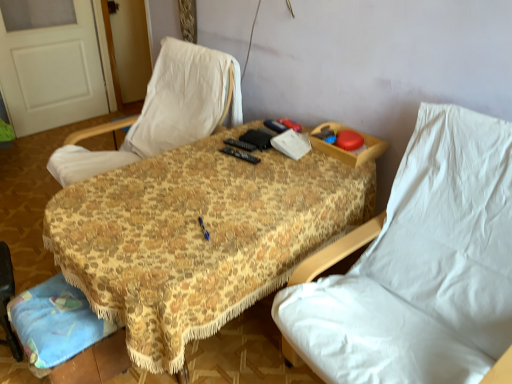
Question: Does white matte door at upper left have a lesser width compared to white fabric chair at right, positioned as the first chair in right-to-left order?

Choices:
 (A) yes
 (B) no

Answer: (A)

Question: Is white fabric chair at right, positioned as the first chair in right-to-left order, completely or partially inside white matte door at upper left?

Choices:
 (A) yes
 (B) no

Answer: (B)

Question: Is the depth of white matte door at upper left greater than that of white fabric chair at right, positioned as the first chair in right-to-left order?

Choices:
 (A) no
 (B) yes

Answer: (B)

Question: Is white matte door at upper left smaller than white fabric chair at right, positioned as the first chair in right-to-left order?

Choices:
 (A) no
 (B) yes

Answer: (B)

Question: Is white matte door at upper left beside white fabric chair at right, the second chair viewed from the left?

Choices:
 (A) no
 (B) yes

Answer: (A)

Question: Is white matte door at upper left taller than white fabric chair at right, positioned as the first chair in right-to-left order?

Choices:
 (A) yes
 (B) no

Answer: (A)

Question: From the image's perspective, would you say white fabric chair at center, which ranks as the 1th chair in left-to-right order, is shown under floral fabric table at center?

Choices:
 (A) yes
 (B) no

Answer: (B)

Question: Does white fabric chair at center, which ranks as the 1th chair in left-to-right order, come in front of floral fabric table at center?

Choices:
 (A) no
 (B) yes

Answer: (A)

Question: Considering the relative sizes of white fabric chair at center, which ranks as the 1th chair in left-to-right order, and floral fabric table at center in the image provided, is white fabric chair at center, which ranks as the 1th chair in left-to-right order, thinner than floral fabric table at center?

Choices:
 (A) no
 (B) yes

Answer: (B)

Question: Can you confirm if white fabric chair at center, the 2th chair when ordered from right to left, is smaller than floral fabric table at center?

Choices:
 (A) no
 (B) yes

Answer: (B)

Question: Is floral fabric table at center inside white fabric chair at center, which ranks as the 1th chair in left-to-right order?

Choices:
 (A) yes
 (B) no

Answer: (B)

Question: Can you confirm if white fabric chair at center, the 2th chair when ordered from right to left, is positioned to the right of floral fabric table at center?

Choices:
 (A) yes
 (B) no

Answer: (B)

Question: Does floral fabric table at center come in front of white matte door at upper left?

Choices:
 (A) yes
 (B) no

Answer: (A)